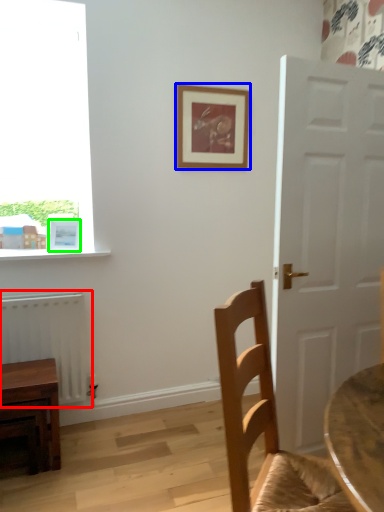
Question: Which object is the farthest from radiator (highlighted by a red box)? Choose among these: picture frame (highlighted by a blue box) or picture frame (highlighted by a green box).

Choices:
 (A) picture frame
 (B) picture frame

Answer: (A)